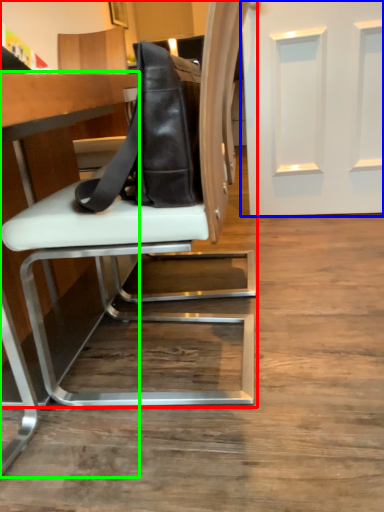
Question: Which object is positioned farthest from chair (highlighted by a red box)? Select from door (highlighted by a blue box) and table (highlighted by a green box).

Choices:
 (A) door
 (B) table

Answer: (A)